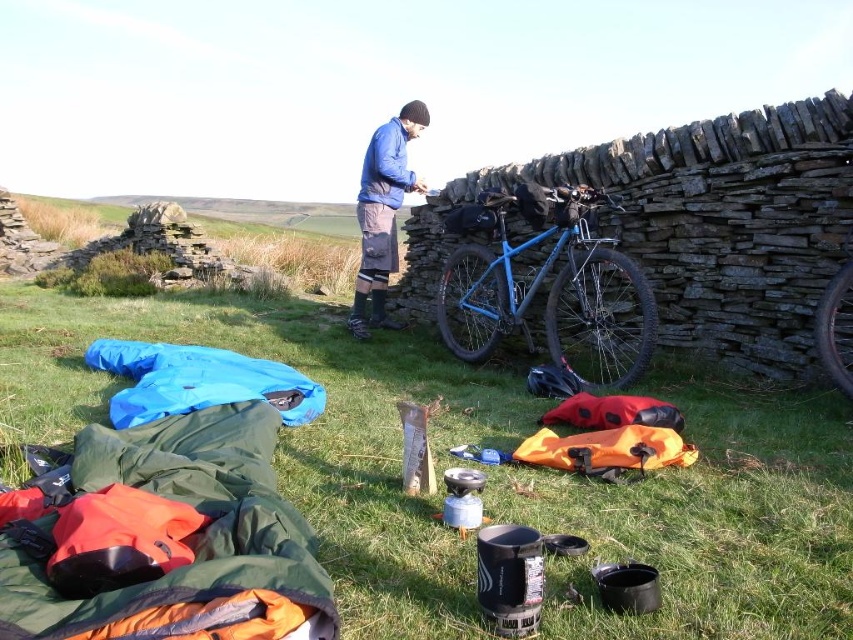
Question: Which point is closer to the camera?

Choices:
 (A) (459, 346)
 (B) (320, 381)
 (C) (364, 172)

Answer: (B)

Question: Does green grass at center have a greater width compared to blue fleece jacket at center?

Choices:
 (A) no
 (B) yes

Answer: (B)

Question: Which object is farther from the camera taking this photo?

Choices:
 (A) blue fleece jacket at center
 (B) blue matte bicycle at center
 (C) green grass at center

Answer: (C)

Question: Is green grass at center to the right of blue matte bicycle at center from the viewer's perspective?

Choices:
 (A) yes
 (B) no

Answer: (B)

Question: Does blue matte bicycle at center come in front of blue fleece jacket at center?

Choices:
 (A) yes
 (B) no

Answer: (A)

Question: Which is nearer to the blue matte bicycle at center?

Choices:
 (A) green grass at center
 (B) blue fleece jacket at center

Answer: (B)